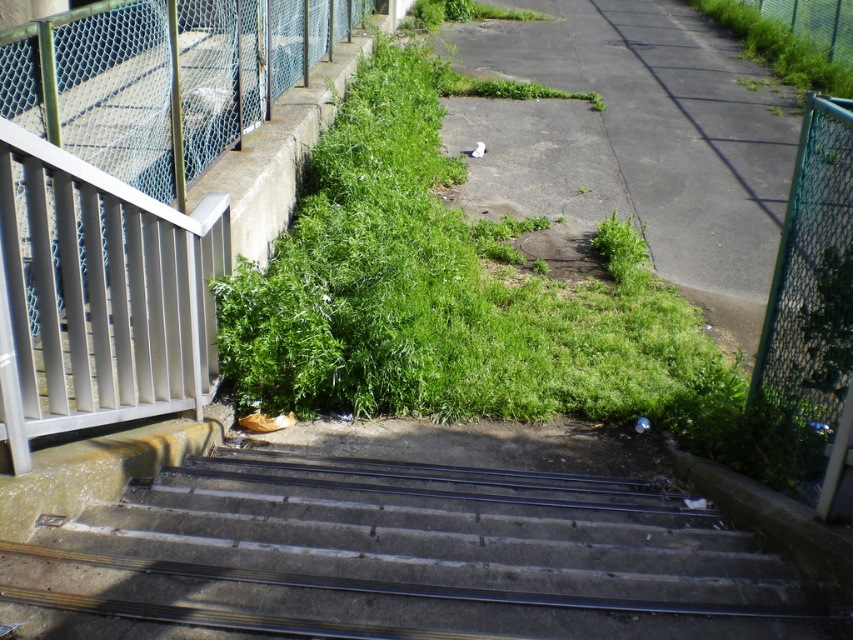
Can you confirm if concrete stairs at center is taller than green mesh fence at right?

Incorrect, concrete stairs at center's height is not larger of green mesh fence at right's.

Can you confirm if concrete stairs at center is shorter than green mesh fence at right?

Indeed, concrete stairs at center has a lesser height compared to green mesh fence at right.

Is point (717, 593) closer to camera compared to point (822, 132)?

That is True.

The height and width of the screenshot is (640, 853). I want to click on concrete stairs at center, so click(x=412, y=556).

Identify the location of green mesh fence at right. (811, 275).

Can you confirm if green mesh fence at right is positioned below green leafy weed at center?

Correct, green mesh fence at right is located below green leafy weed at center.

The height and width of the screenshot is (640, 853). I want to click on green mesh fence at right, so click(811, 275).

Between green leafy grass at center and green grass at upper right, which one is positioned lower?

green leafy grass at center is below.

Between point (824, 138) and point (750, 28), which one is positioned in front?

Point (824, 138)

At what (x,y) coordinates should I click in order to perform the action: click on green leafy grass at center. Please return your answer as a coordinate pair (x, y). This screenshot has height=640, width=853. Looking at the image, I should click on (521, 305).